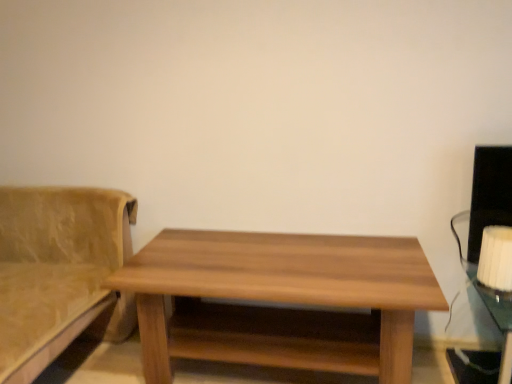
Question: Is suede-like beige couch at left oriented away from wooden table at center?

Choices:
 (A) yes
 (B) no

Answer: (B)

Question: From the image's perspective, is suede-like beige couch at left over wooden table at center?

Choices:
 (A) yes
 (B) no

Answer: (A)

Question: Can you confirm if suede-like beige couch at left is positioned to the left of wooden table at center?

Choices:
 (A) yes
 (B) no

Answer: (A)

Question: Is suede-like beige couch at left surrounding wooden table at center?

Choices:
 (A) no
 (B) yes

Answer: (A)

Question: From the image's perspective, is suede-like beige couch at left located beneath wooden table at center?

Choices:
 (A) no
 (B) yes

Answer: (A)

Question: Can you confirm if suede-like beige couch at left is smaller than wooden table at center?

Choices:
 (A) no
 (B) yes

Answer: (A)

Question: From the image's perspective, is white fabric lampshade at right over suede-like beige couch at left?

Choices:
 (A) yes
 (B) no

Answer: (A)

Question: Is white fabric lampshade at right located outside suede-like beige couch at left?

Choices:
 (A) no
 (B) yes

Answer: (B)

Question: Considering the relative sizes of white fabric lampshade at right and suede-like beige couch at left in the image provided, is white fabric lampshade at right bigger than suede-like beige couch at left?

Choices:
 (A) yes
 (B) no

Answer: (B)

Question: Is white fabric lampshade at right closer to camera compared to suede-like beige couch at left?

Choices:
 (A) yes
 (B) no

Answer: (B)

Question: Considering the relative positions of white fabric lampshade at right and suede-like beige couch at left in the image provided, is white fabric lampshade at right to the right of suede-like beige couch at left from the viewer's perspective?

Choices:
 (A) no
 (B) yes

Answer: (B)

Question: Can suede-like beige couch at left be found inside white fabric lampshade at right?

Choices:
 (A) yes
 (B) no

Answer: (B)

Question: Considering the relative sizes of wooden table at center and white fabric lampshade at right in the image provided, is wooden table at center thinner than white fabric lampshade at right?

Choices:
 (A) no
 (B) yes

Answer: (A)